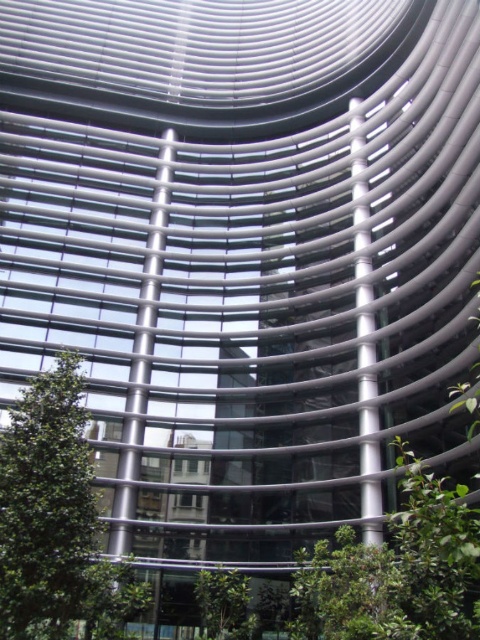
Question: Among these points, which one is farthest from the camera?

Choices:
 (A) (210, 588)
 (B) (36, 621)

Answer: (A)

Question: Among these objects, which one is farthest from the camera?

Choices:
 (A) green leafy tree at lower center
 (B) green leafy tree at lower left

Answer: (A)

Question: Can you confirm if green leafy tree at lower left is wider than green leafy tree at lower center?

Choices:
 (A) no
 (B) yes

Answer: (A)

Question: Does green leafy tree at lower left appear over green leafy tree at lower center?

Choices:
 (A) yes
 (B) no

Answer: (A)

Question: Can you confirm if green leafy tree at lower left is positioned to the left of green leafy tree at lower center?

Choices:
 (A) yes
 (B) no

Answer: (A)

Question: Which point is closer to the camera?

Choices:
 (A) green leafy tree at lower left
 (B) green leafy tree at lower center

Answer: (A)